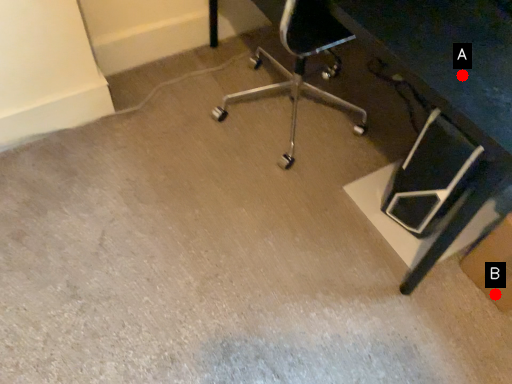
Question: Two points are circled on the image, labeled by A and B beside each circle. Which point is further to the camera?

Choices:
 (A) A is further
 (B) B is further

Answer: (B)